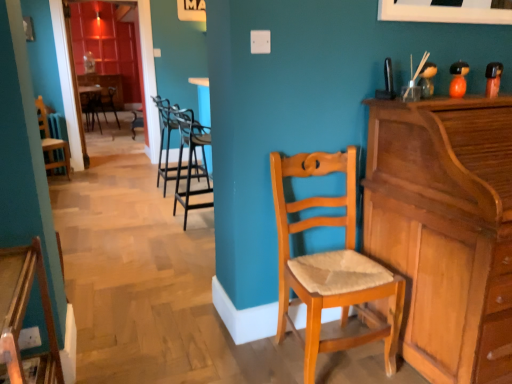
Locate an element on the screen. Image resolution: width=512 pixels, height=384 pixels. free space in front of black metal barstools at center, marked as the 2th chair in a right-to-left arrangement is located at coordinates (177, 238).